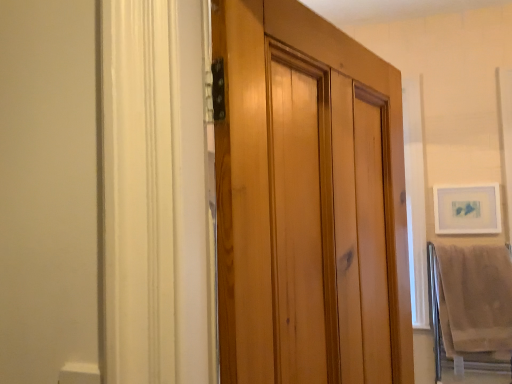
You are a GUI agent. You are given a task and a screenshot of the screen. Output one action in this format:
    pyautogui.click(x=<x>, y=<y>)
    Task: Click on the beige cotton bath towel at lower right
    
    Given the screenshot: What is the action you would take?
    pyautogui.click(x=474, y=298)

What do you see at coordinates (474, 298) in the screenshot?
I see `beige cotton bath towel at lower right` at bounding box center [474, 298].

Find the location of `matte white picture frame at upper right`. matte white picture frame at upper right is located at coordinates (467, 209).

The width and height of the screenshot is (512, 384). What do you see at coordinates (467, 209) in the screenshot?
I see `matte white picture frame at upper right` at bounding box center [467, 209].

Find the location of a particular element. The image size is (512, 384). beige cotton bath towel at lower right is located at coordinates (474, 298).

Is matte white picture frame at upper right to the left of beige cotton bath towel at lower right from the viewer's perspective?

Incorrect, matte white picture frame at upper right is not on the left side of beige cotton bath towel at lower right.

Is matte white picture frame at upper right positioned before beige cotton bath towel at lower right?

No.

Which is in front, point (463, 218) or point (501, 254)?

The point (501, 254) is closer.

From the image's perspective, between matte white picture frame at upper right and beige cotton bath towel at lower right, who is located below?

beige cotton bath towel at lower right appears lower in the image.

From a real-world perspective, is matte white picture frame at upper right physically below beige cotton bath towel at lower right?

No, from a real-world perspective, matte white picture frame at upper right is not beneath beige cotton bath towel at lower right.

Considering the sizes of objects matte white picture frame at upper right and beige cotton bath towel at lower right in the image provided, who is thinner, matte white picture frame at upper right or beige cotton bath towel at lower right?

With smaller width is matte white picture frame at upper right.

Who is shorter, matte white picture frame at upper right or beige cotton bath towel at lower right?

With less height is matte white picture frame at upper right.

Considering the sizes of objects matte white picture frame at upper right and beige cotton bath towel at lower right in the image provided, who is bigger, matte white picture frame at upper right or beige cotton bath towel at lower right?

With larger size is beige cotton bath towel at lower right.

Would you say matte white picture frame at upper right is outside beige cotton bath towel at lower right?

That's correct, matte white picture frame at upper right is outside of beige cotton bath towel at lower right.

Is matte white picture frame at upper right in contact with beige cotton bath towel at lower right?

No, matte white picture frame at upper right is not next to beige cotton bath towel at lower right.

Is matte white picture frame at upper right facing away from beige cotton bath towel at lower right?

matte white picture frame at upper right is not turned away from beige cotton bath towel at lower right.

Find the location of a particular element. picture frame behind the beige cotton bath towel at lower right is located at coordinates (467, 209).

Considering the positions of objects beige cotton bath towel at lower right and matte white picture frame at upper right in the image provided, who is more to the right, beige cotton bath towel at lower right or matte white picture frame at upper right?

From the viewer's perspective, matte white picture frame at upper right appears more on the right side.

Between beige cotton bath towel at lower right and matte white picture frame at upper right, which one is positioned behind?

matte white picture frame at upper right.

Between point (451, 258) and point (436, 213), which one is positioned behind?

The point (436, 213) is behind.

From the image's perspective, is beige cotton bath towel at lower right located above or below matte white picture frame at upper right?

Clearly, from the image's perspective, beige cotton bath towel at lower right is below matte white picture frame at upper right.

From a real-world perspective, which object rests below the other?

beige cotton bath towel at lower right.

Which object is wider, beige cotton bath towel at lower right or matte white picture frame at upper right?

beige cotton bath towel at lower right is wider.

Considering the relative sizes of beige cotton bath towel at lower right and matte white picture frame at upper right in the image provided, is beige cotton bath towel at lower right shorter than matte white picture frame at upper right?

No, beige cotton bath towel at lower right is not shorter than matte white picture frame at upper right.

Is beige cotton bath towel at lower right bigger or smaller than matte white picture frame at upper right?

Clearly, beige cotton bath towel at lower right is larger in size than matte white picture frame at upper right.

Do you think beige cotton bath towel at lower right is within matte white picture frame at upper right, or outside of it?

beige cotton bath towel at lower right is located beyond the bounds of matte white picture frame at upper right.

Is beige cotton bath towel at lower right directly adjacent to matte white picture frame at upper right?

beige cotton bath towel at lower right and matte white picture frame at upper right are not in contact.

Is beige cotton bath towel at lower right oriented towards matte white picture frame at upper right?

No, beige cotton bath towel at lower right is not facing towards matte white picture frame at upper right.

How many degrees apart are the facing directions of beige cotton bath towel at lower right and matte white picture frame at upper right?

0.000211 degrees.

How far apart are beige cotton bath towel at lower right and matte white picture frame at upper right?

beige cotton bath towel at lower right is 12.88 inches away from matte white picture frame at upper right.

Image resolution: width=512 pixels, height=384 pixels. Find the location of `bath towel below the matte white picture frame at upper right (from a real-world perspective)`. bath towel below the matte white picture frame at upper right (from a real-world perspective) is located at coordinates (474, 298).

This screenshot has width=512, height=384. In order to click on picture frame on the right of beige cotton bath towel at lower right in this screenshot , I will do `click(467, 209)`.

Where is `bath towel located in front of the matte white picture frame at upper right`? The height and width of the screenshot is (384, 512). bath towel located in front of the matte white picture frame at upper right is located at coordinates (474, 298).